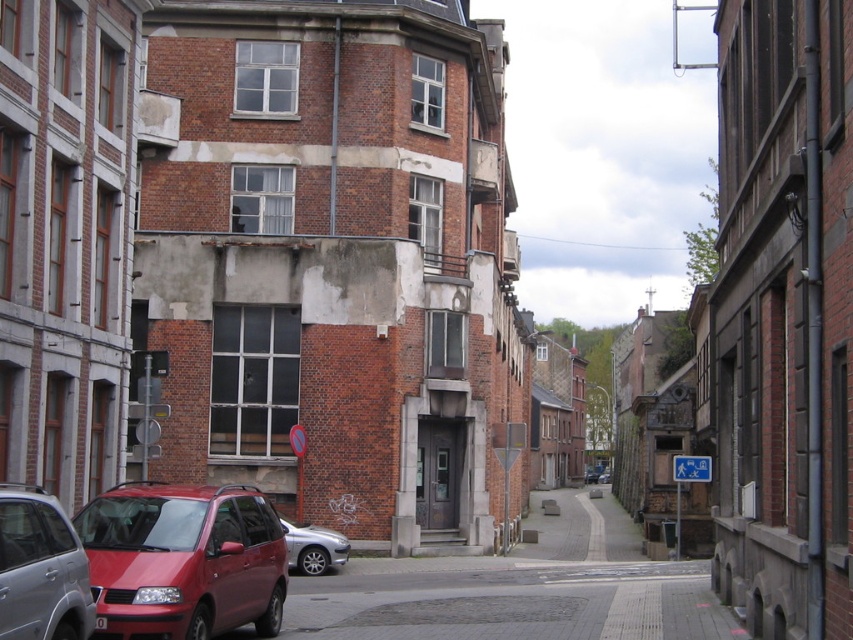
You are a delivery driver trying to park your truck in this narrow street. The truck is 10 meters long. There is a point marked at coordinates (183, 561) which indicates the location of the matte red minivan at lower left. Can you safely park your truck without overlapping any parked cars?

The point at coordinates (183, 561) indicates the matte red minivan at lower left. Since the truck is 10 meters long and the street is narrow with parked cars along the left side, including the matte red minivan at lower left, it is unlikely that you can safely park the truck without overlapping other vehicles.

You are standing at the intersection of this narrow urban street. You see a point marked at coordinates [183,561]. Which object does this point correspond to?

The point at coordinates [183,561] corresponds to the matte red minivan at lower left.